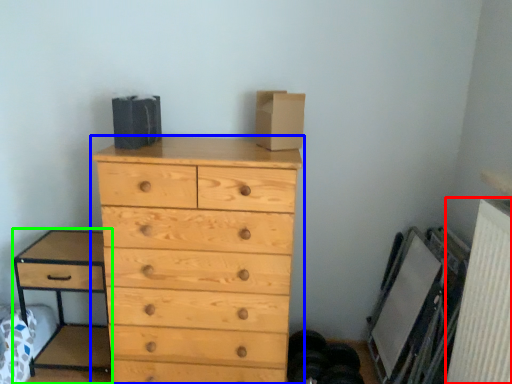
Question: Considering the real-world distances, which object is farthest from radiator (highlighted by a red box)? chest of drawers (highlighted by a blue box) or nightstand (highlighted by a green box)?

Choices:
 (A) chest of drawers
 (B) nightstand

Answer: (B)